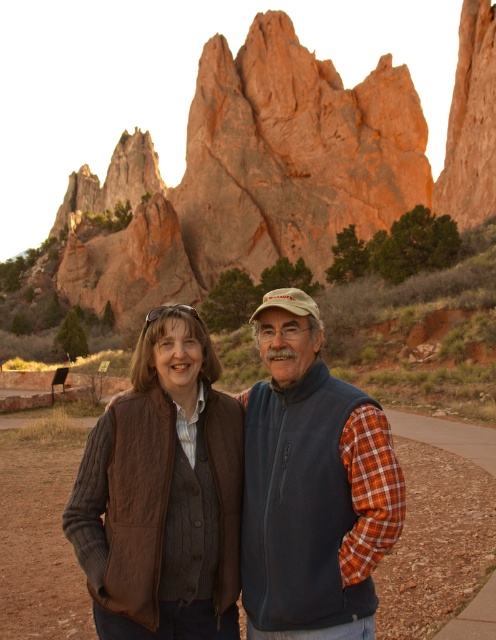
Describe the element at coordinates (163, 499) in the screenshot. I see `brown leather vest at center` at that location.

Can you confirm if brown leather vest at center is taller than blue fleece vest at center?

In fact, brown leather vest at center may be shorter than blue fleece vest at center.

Describe the element at coordinates (163, 499) in the screenshot. The height and width of the screenshot is (640, 496). I see `brown leather vest at center` at that location.

I want to click on brown leather vest at center, so click(x=163, y=499).